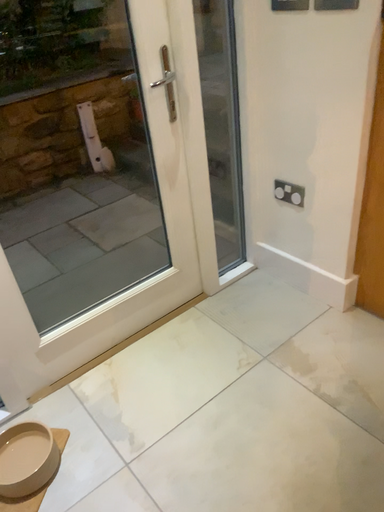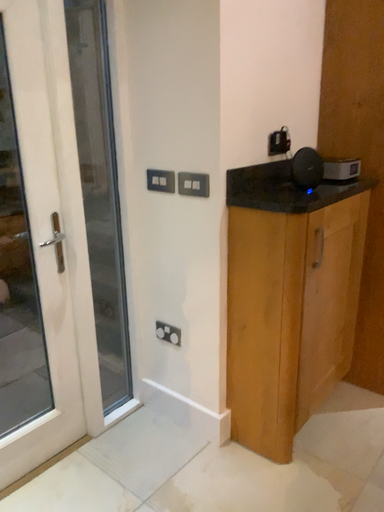
Question: How did the camera likely rotate when shooting the video?

Choices:
 (A) rotated downward
 (B) rotated upward

Answer: (B)